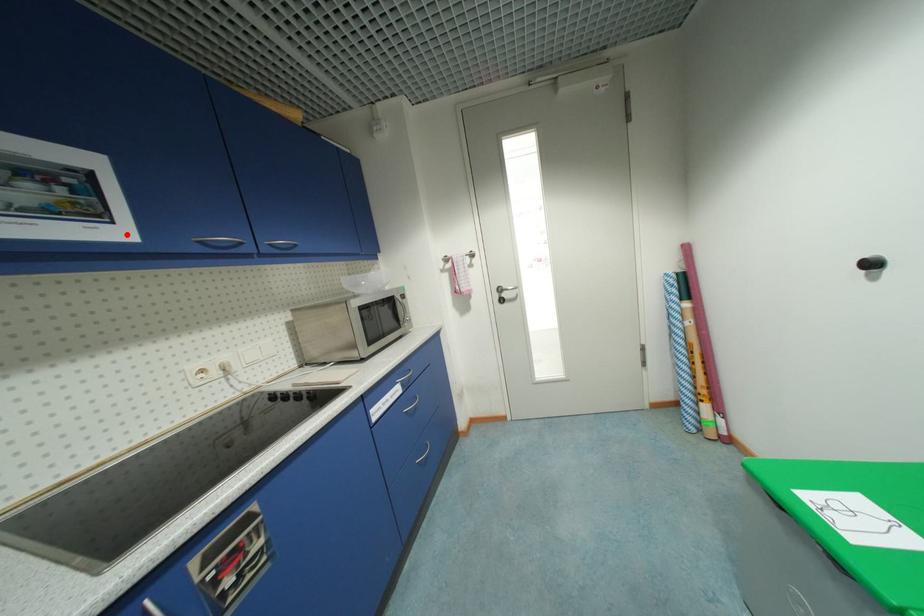
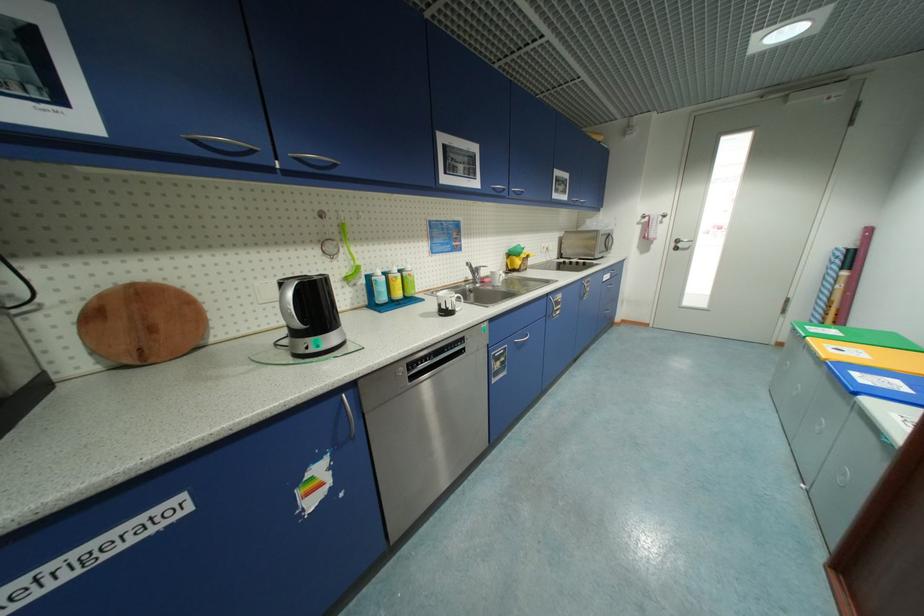
Locate, in the second image, the point that corresponds to the highlighted location in the first image.

(570, 199)